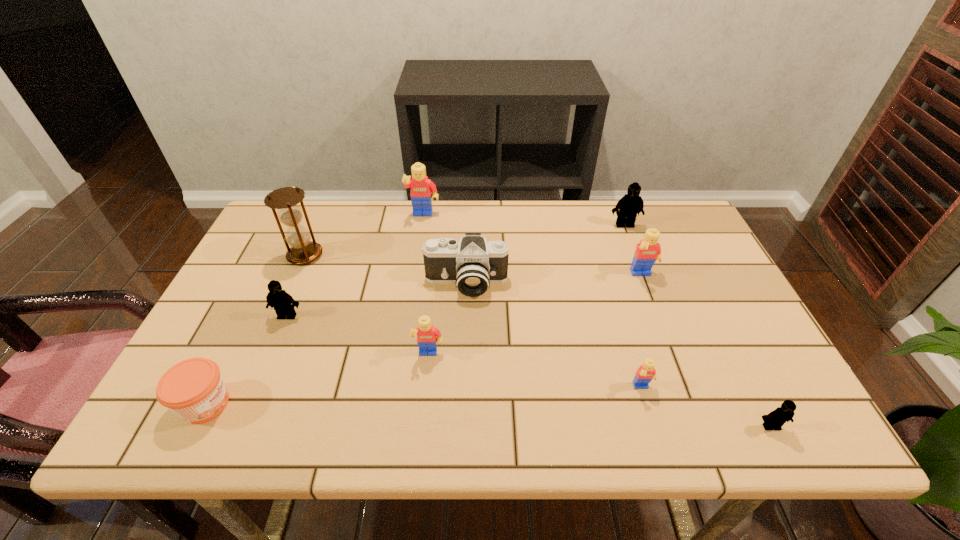
At what (x,y) coordinates should I click in order to perform the action: click on hourglass that is positioned at the left edge. Please return your answer as a coordinate pair (x, y). Looking at the image, I should click on (302, 251).

You are a GUI agent. You are given a task and a screenshot of the screen. Output one action in this format:
    pyautogui.click(x=<x>, y=<y>)
    Task: Click on the Lego that is at the left edge
    This screenshot has width=960, height=540.
    Given the screenshot: What is the action you would take?
    pyautogui.click(x=283, y=303)

Where is `jam located in the left edge section of the desktop`? Image resolution: width=960 pixels, height=540 pixels. jam located in the left edge section of the desktop is located at coordinates (193, 389).

Identify the location of object located at the right edge. The image size is (960, 540). (776, 419).

The image size is (960, 540). I want to click on object that is at the far left corner, so click(x=302, y=251).

Where is `object at the near left corner`? object at the near left corner is located at coordinates (193, 389).

Identify the location of object that is at the near right corner. (776, 419).

Identify the location of free space at the far edge. The height and width of the screenshot is (540, 960). (458, 203).

Identify the location of free space at the near edge of the desktop. The width and height of the screenshot is (960, 540). 586,434.

In the image, there is a desktop. In order to click on blank space at the left edge in this screenshot , I will do `click(243, 293)`.